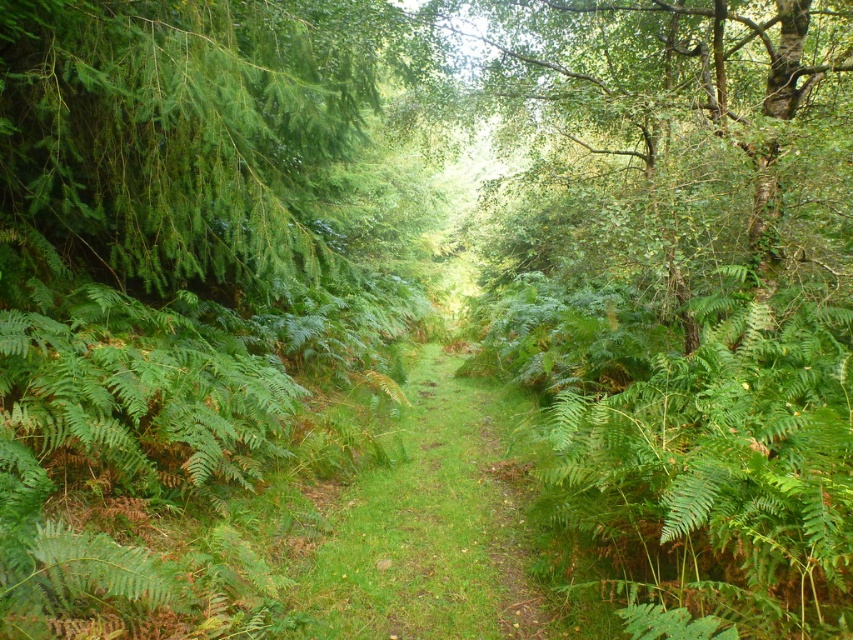
Question: Does green leafy tree at left have a greater width compared to green grassy forest path at center?

Choices:
 (A) yes
 (B) no

Answer: (B)

Question: Observing the image, what is the correct spatial positioning of green leafy tree at left in reference to green grassy forest path at center?

Choices:
 (A) above
 (B) below

Answer: (A)

Question: Which object appears farthest from the camera in this image?

Choices:
 (A) green leafy tree at left
 (B) green grassy forest path at center

Answer: (A)

Question: Among these points, which one is nearest to the camera?

Choices:
 (A) (461, 636)
 (B) (357, 93)

Answer: (A)

Question: Which point is closer to the camera?

Choices:
 (A) green leafy tree at left
 (B) green grassy forest path at center

Answer: (B)

Question: Is green leafy tree at left positioned before green grassy forest path at center?

Choices:
 (A) no
 (B) yes

Answer: (A)